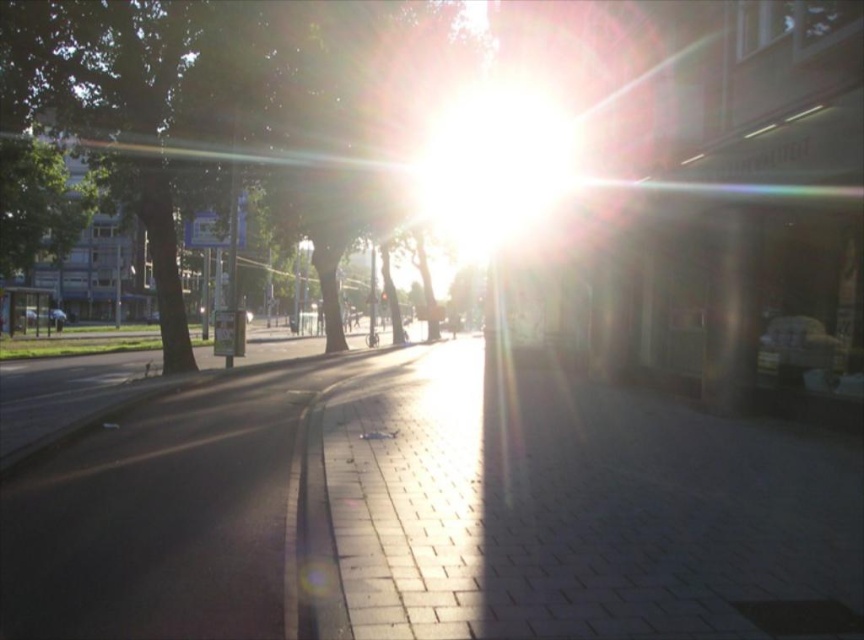
You are standing on the street and want to walk to the brick pavement at center. According to the coordinates provided, in which direction should you move relative to your current position at point (x=433, y=509)?

You are already at the brick pavement at center since the point (x=433, y=509) marks its location.

You are a photographer wanting to capture the entire scene in one shot. Given that the brick pavement at center and the green leafy tree at center are both in your frame, which object takes up more space in the image?

The green leafy tree at center occupies more space in the image than the brick pavement at center, as it is stated that the brick pavement at center occupies less space than the green leafy tree at center.